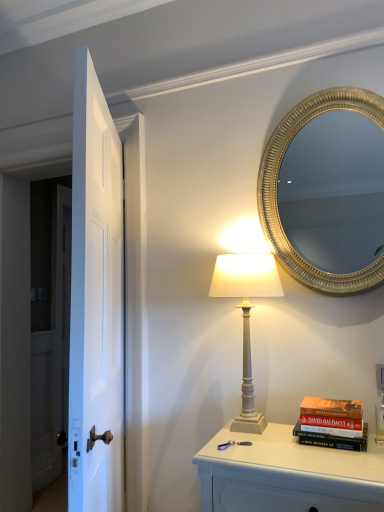
You are a GUI agent. You are given a task and a screenshot of the screen. Output one action in this format:
    pyautogui.click(x=<x>, y=<y>)
    Task: Click on the blank space situated above hardcover book at right (from a real-world perspective)
    
    Given the screenshot: What is the action you would take?
    pyautogui.click(x=332, y=404)